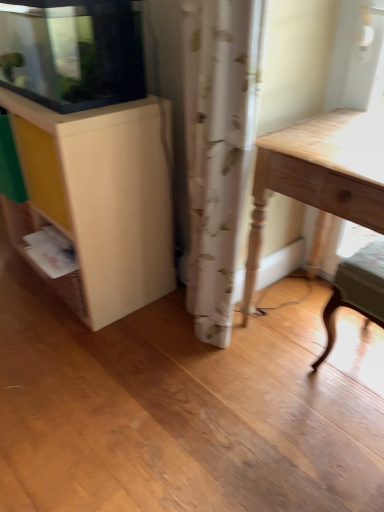
Image resolution: width=384 pixels, height=512 pixels. What do you see at coordinates (319, 179) in the screenshot?
I see `light wood table at right` at bounding box center [319, 179].

What do you see at coordinates (42, 170) in the screenshot?
I see `matte yellow drawer at left` at bounding box center [42, 170].

Locate an element on the screen. This screenshot has width=384, height=512. matte white cabinet at upper left, placed as the 1th cabinetry when sorted from top to bottom is located at coordinates (72, 52).

Between wooden chair at lower right and light wood table at right, which one has smaller width?

With smaller width is wooden chair at lower right.

Is wooden chair at lower right inside the boundaries of light wood table at right, or outside?

wooden chair at lower right is inside light wood table at right.

Is light wood table at right at the back of wooden chair at lower right?

Correct, wooden chair at lower right is looking away from light wood table at right.

Does wooden chair at lower right lie in front of matte yellow drawer at left?

Yes, the depth of wooden chair at lower right is less than that of matte yellow drawer at left.

Is there a large distance between wooden chair at lower right and matte yellow drawer at left?

No, wooden chair at lower right is in close proximity to matte yellow drawer at left.

Considering the relative sizes of wooden chair at lower right and matte yellow drawer at left in the image provided, is wooden chair at lower right wider than matte yellow drawer at left?

Yes.

Considering the relative sizes of wooden chair at lower right and matte yellow drawer at left in the image provided, is wooden chair at lower right shorter than matte yellow drawer at left?

Incorrect, the height of wooden chair at lower right does not fall short of that of matte yellow drawer at left.

From the image's perspective, is matte white cabinet at left, which appears as the 2th cabinetry when viewed from the top, located above matte white cabinet at upper left, which is the second cabinetry from bottom to top?

Actually, matte white cabinet at left, which appears as the 2th cabinetry when viewed from the top, appears below matte white cabinet at upper left, which is the second cabinetry from bottom to top, in the image.

Does matte white cabinet at left, which ranks as the first cabinetry in bottom-to-top order, touch matte white cabinet at upper left, placed as the 1th cabinetry when sorted from top to bottom?

No, matte white cabinet at left, which ranks as the first cabinetry in bottom-to-top order, is not with matte white cabinet at upper left, placed as the 1th cabinetry when sorted from top to bottom.

Is matte white cabinet at left, which appears as the 2th cabinetry when viewed from the top, aimed at matte white cabinet at upper left, placed as the 1th cabinetry when sorted from top to bottom?

No, matte white cabinet at left, which appears as the 2th cabinetry when viewed from the top, does not turn towards matte white cabinet at upper left, placed as the 1th cabinetry when sorted from top to bottom.

Considering their positions, is matte white cabinet at left, which appears as the 2th cabinetry when viewed from the top, located in front of or behind matte white cabinet at upper left, which is the second cabinetry from bottom to top?

matte white cabinet at left, which appears as the 2th cabinetry when viewed from the top, is positioned farther from the viewer than matte white cabinet at upper left, which is the second cabinetry from bottom to top.

How much distance is there between matte white cabinet at upper left, which is the second cabinetry from bottom to top, and light wood table at right?

matte white cabinet at upper left, which is the second cabinetry from bottom to top, and light wood table at right are 25.05 inches apart.

Which is more to the left, matte white cabinet at upper left, which is the second cabinetry from bottom to top, or light wood table at right?

matte white cabinet at upper left, which is the second cabinetry from bottom to top, is more to the left.

Is matte white cabinet at upper left, which is the second cabinetry from bottom to top, directly adjacent to light wood table at right?

matte white cabinet at upper left, which is the second cabinetry from bottom to top, is not next to light wood table at right, and they're not touching.

Is matte white cabinet at upper left, placed as the 1th cabinetry when sorted from top to bottom, outside of light wood table at right?

Yes.

Is wooden chair at lower right at the right side of matte white cabinet at left, which ranks as the first cabinetry in bottom-to-top order?

Yes.

Is there a large distance between wooden chair at lower right and matte white cabinet at left, which ranks as the first cabinetry in bottom-to-top order?

No.

Which object is thinner, wooden chair at lower right or matte white cabinet at left, which ranks as the first cabinetry in bottom-to-top order?

wooden chair at lower right is thinner.

From the picture: How different are the orientations of wooden chair at lower right and matte white cabinet at left, which appears as the 2th cabinetry when viewed from the top, in degrees?

1.83 degrees separate the facing orientations of wooden chair at lower right and matte white cabinet at left, which appears as the 2th cabinetry when viewed from the top.

At what (x,y) coordinates should I click in order to perform the action: click on drawer positioned vertically above the light wood table at right (from a real-world perspective). Please return your answer as a coordinate pair (x, y). This screenshot has width=384, height=512. Looking at the image, I should click on (42, 170).

Considering the points (297, 155) and (43, 203), which point is in front, point (297, 155) or point (43, 203)?

Point (297, 155)

Which object is further away from the camera taking this photo, light wood table at right or matte yellow drawer at left?

matte yellow drawer at left.

Is light wood table at right wider than matte yellow drawer at left?

Yes.

From a real-world perspective, between matte yellow drawer at left and matte white cabinet at left, which ranks as the first cabinetry in bottom-to-top order, who is vertically lower?

From a 3D spatial view, matte white cabinet at left, which ranks as the first cabinetry in bottom-to-top order, is below.

Between matte yellow drawer at left and matte white cabinet at left, which appears as the 2th cabinetry when viewed from the top, which one appears on the right side from the viewer's perspective?

Positioned to the right is matte white cabinet at left, which appears as the 2th cabinetry when viewed from the top.

Does matte yellow drawer at left have a greater width compared to matte white cabinet at left, which ranks as the first cabinetry in bottom-to-top order?

No.

Is the position of matte yellow drawer at left less distant than that of matte white cabinet at left, which ranks as the first cabinetry in bottom-to-top order?

No.

I want to click on table in front of the wooden chair at lower right, so (319, 179).

Image resolution: width=384 pixels, height=512 pixels. I want to click on drawer behind the wooden chair at lower right, so click(x=42, y=170).

Estimate the real-world distances between objects in this image. Which object is closer to wooden chair at lower right, light wood table at right or matte white cabinet at left, which appears as the 2th cabinetry when viewed from the top?

light wood table at right is closer to wooden chair at lower right.

Based on their spatial positions, is matte yellow drawer at left or matte white cabinet at upper left, placed as the 1th cabinetry when sorted from top to bottom, further from light wood table at right?

matte yellow drawer at left is positioned further to the anchor light wood table at right.

From the image, which object appears to be farther from matte white cabinet at upper left, placed as the 1th cabinetry when sorted from top to bottom, wooden chair at lower right or light wood table at right?

Based on the image, wooden chair at lower right appears to be further to matte white cabinet at upper left, placed as the 1th cabinetry when sorted from top to bottom.

Based on their spatial positions, is matte white cabinet at upper left, which is the second cabinetry from bottom to top, or matte white cabinet at left, which ranks as the first cabinetry in bottom-to-top order, closer to light wood table at right?

matte white cabinet at left, which ranks as the first cabinetry in bottom-to-top order, is closer to light wood table at right.

Considering their positions, is matte white cabinet at left, which ranks as the first cabinetry in bottom-to-top order, positioned closer to wooden chair at lower right than light wood table at right?

→ Among the two, light wood table at right is located nearer to wooden chair at lower right.

From the image, which object appears to be nearer to matte white cabinet at upper left, which is the second cabinetry from bottom to top, matte yellow drawer at left or wooden chair at lower right?

Based on the image, matte yellow drawer at left appears to be nearer to matte white cabinet at upper left, which is the second cabinetry from bottom to top.

Which object lies further to the anchor point wooden chair at lower right, matte white cabinet at upper left, which is the second cabinetry from bottom to top, or matte yellow drawer at left?

matte white cabinet at upper left, which is the second cabinetry from bottom to top.

From the image, which object appears to be farther from matte yellow drawer at left, wooden chair at lower right or matte white cabinet at left, which ranks as the first cabinetry in bottom-to-top order?

wooden chair at lower right.

At what (x,y) coordinates should I click in order to perform the action: click on cabinetry situated between matte white cabinet at left, which appears as the 2th cabinetry when viewed from the top, and light wood table at right from left to right. Please return your answer as a coordinate pair (x, y). Looking at the image, I should click on (72, 52).

At what (x,y) coordinates should I click in order to perform the action: click on table between matte white cabinet at left, which appears as the 2th cabinetry when viewed from the top, and wooden chair at lower right from left to right. Please return your answer as a coordinate pair (x, y). The width and height of the screenshot is (384, 512). Looking at the image, I should click on (319, 179).

Find the location of a particular element. Image resolution: width=384 pixels, height=512 pixels. cabinetry between matte white cabinet at upper left, placed as the 1th cabinetry when sorted from top to bottom, and matte yellow drawer at left vertically is located at coordinates (103, 196).

Identify the location of table situated between matte white cabinet at upper left, which is the second cabinetry from bottom to top, and wooden chair at lower right from left to right. (319, 179).